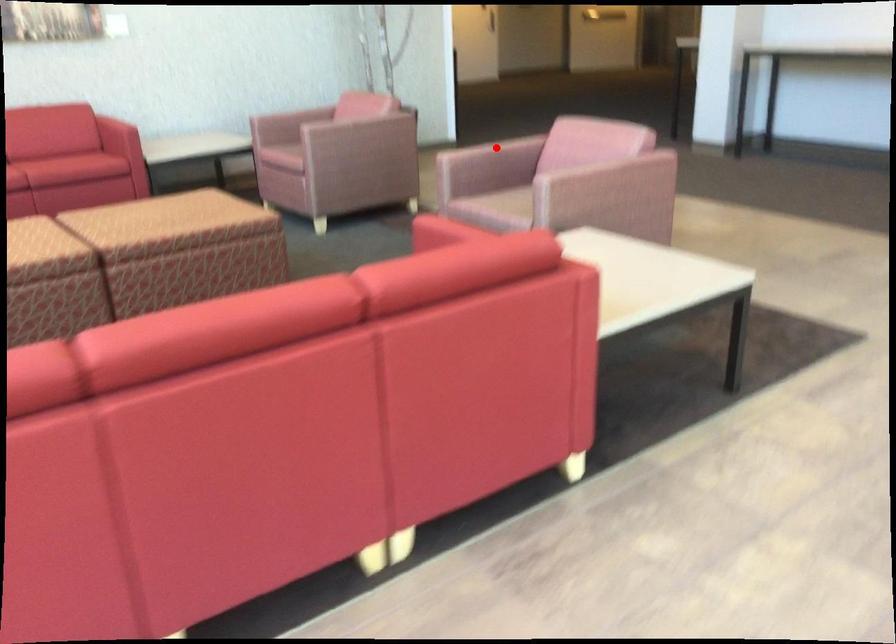
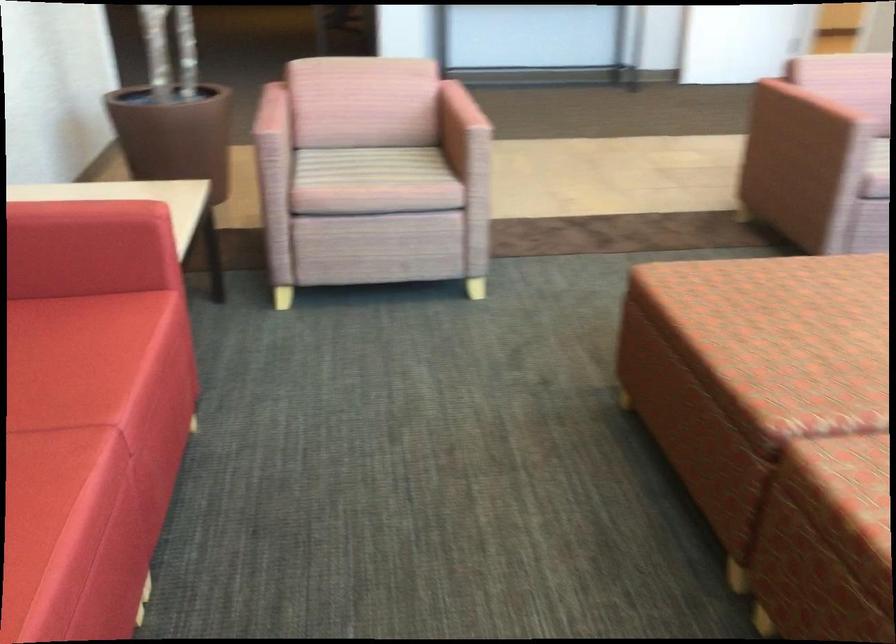
Where in the second image is the point corresponding to the highlighted location from the first image?

(810, 108)